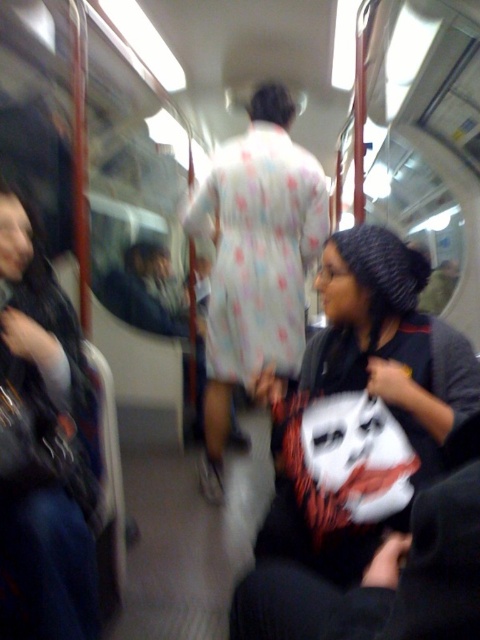
You are a delivery robot carrying a package that requires a clear path of at least 30 inches. You need to navigate between the white printed shirt at center and the dark blue jeans at left. Can you safely pass through the space between them?

The white printed shirt at center and dark blue jeans at left are 27.57 inches apart, which is less than the required 30 inches. Therefore, the delivery robot cannot safely pass through the space between them.

You are standing inside a moving train car and notice two points marked on the floor. One is at coordinates point (276, 435) and the other at point (62, 404). If you want to reach the point closer to you first, which coordinate should you step towards?

You should step towards point (62, 404) because it is closer to you than point (276, 435), which is further away.